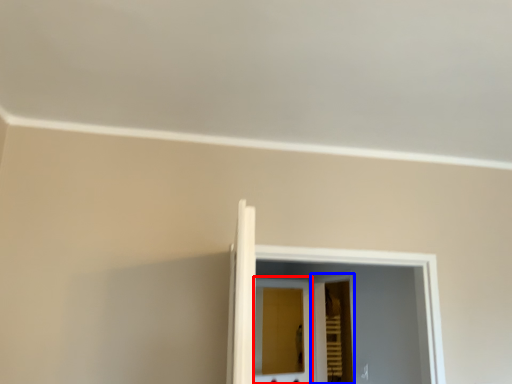
Question: Which object is closer to the camera taking this photo, screen door (highlighted by a red box) or screen door (highlighted by a blue box)?

Choices:
 (A) screen door
 (B) screen door

Answer: (B)